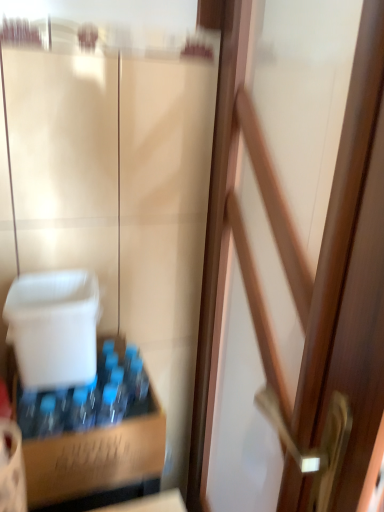
You are a GUI agent. You are given a task and a screenshot of the screen. Output one action in this format:
    pyautogui.click(x=<x>, y=<y>)
    Task: Click on the wooden door at center
    
    Given the screenshot: What is the action you would take?
    pyautogui.click(x=319, y=253)

In order to face wooden door at center, should I rotate leftwards or rightwards?

A 10.251 degree turn to the right will do.

The height and width of the screenshot is (512, 384). What do you see at coordinates (319, 253) in the screenshot?
I see `wooden door at center` at bounding box center [319, 253].

Measure the distance between point (224,249) and camera.

A distance of 1.08 meters exists between point (224,249) and camera.

Image resolution: width=384 pixels, height=512 pixels. In order to click on brown cardboard box at lower left in this screenshot , I will do `click(93, 437)`.

Describe the element at coordinates (93, 437) in the screenshot. I see `brown cardboard box at lower left` at that location.

At what (x,y) coordinates should I click in order to perform the action: click on wooden door at center. Please return your answer as a coordinate pair (x, y). Looking at the image, I should click on (319, 253).

Is brown cardboard box at lower left to the right of wooden door at center from the viewer's perspective?

In fact, brown cardboard box at lower left is to the left of wooden door at center.

From the picture: Is the position of brown cardboard box at lower left more distant than that of wooden door at center?

Yes, it is.

Considering the positions of point (97, 352) and point (333, 220), is point (97, 352) closer or farther from the camera than point (333, 220)?

Point (97, 352) is farther from the camera than point (333, 220).

From the image's perspective, would you say brown cardboard box at lower left is shown under wooden door at center?

Indeed, from the image's perspective, brown cardboard box at lower left is shown beneath wooden door at center.

From a real-world perspective, who is located higher, brown cardboard box at lower left or wooden door at center?

wooden door at center is physically above.

Is brown cardboard box at lower left wider or thinner than wooden door at center?

brown cardboard box at lower left is wider than wooden door at center.

Looking at this image, considering the sizes of objects brown cardboard box at lower left and wooden door at center in the image provided, who is taller, brown cardboard box at lower left or wooden door at center?

Standing taller between the two is wooden door at center.

In terms of size, does brown cardboard box at lower left appear bigger or smaller than wooden door at center?

Clearly, brown cardboard box at lower left is smaller in size than wooden door at center.

Could wooden door at center be considered to be inside brown cardboard box at lower left?

No, brown cardboard box at lower left does not contain wooden door at center.

From the picture: Is brown cardboard box at lower left placed right next to wooden door at center?

No, brown cardboard box at lower left is not in contact with wooden door at center.

Is brown cardboard box at lower left looking in the opposite direction of wooden door at center?

No.

At what (x,y) coordinates should I click in order to perform the action: click on door located above the brown cardboard box at lower left (from a real-world perspective). Please return your answer as a coordinate pair (x, y). Looking at the image, I should click on (319, 253).

Considering the positions of objects wooden door at center and brown cardboard box at lower left in the image provided, who is more to the left, wooden door at center or brown cardboard box at lower left?

brown cardboard box at lower left.

Which object is closer to the camera, wooden door at center or brown cardboard box at lower left?

wooden door at center is more forward.

Which is in front, point (360, 94) or point (64, 425)?

The point (360, 94) is more forward.

From the image's perspective, would you say wooden door at center is positioned over brown cardboard box at lower left?

Indeed, from the image's perspective, wooden door at center is shown above brown cardboard box at lower left.

From a real-world perspective, does wooden door at center stand above brown cardboard box at lower left?

Correct, in the physical world, wooden door at center is higher than brown cardboard box at lower left.

Looking at their sizes, would you say wooden door at center is wider or thinner than brown cardboard box at lower left?

wooden door at center is thinner than brown cardboard box at lower left.

From their relative heights in the image, would you say wooden door at center is taller or shorter than brown cardboard box at lower left?

In the image, wooden door at center appears to be taller than brown cardboard box at lower left.

Does wooden door at center have a smaller size compared to brown cardboard box at lower left?

Actually, wooden door at center might be larger than brown cardboard box at lower left.

Is wooden door at center not within brown cardboard box at lower left?

Indeed, wooden door at center is completely outside brown cardboard box at lower left.

Are wooden door at center and brown cardboard box at lower left far apart?

No, wooden door at center is not far away from brown cardboard box at lower left.

Does wooden door at center turn towards brown cardboard box at lower left?

Yes, wooden door at center is oriented towards brown cardboard box at lower left.

How many degrees apart are the facing directions of wooden door at center and brown cardboard box at lower left?

The angle between the facing direction of wooden door at center and the facing direction of brown cardboard box at lower left is 86.8 degrees.

Find the location of a particular element. cardboard box below the wooden door at center (from the image's perspective) is located at coordinates (93, 437).

Where is `door in front of the brown cardboard box at lower left`? The height and width of the screenshot is (512, 384). door in front of the brown cardboard box at lower left is located at coordinates 319,253.

You are a GUI agent. You are given a task and a screenshot of the screen. Output one action in this format:
    pyautogui.click(x=<x>, y=<y>)
    Task: Click on the door located above the brown cardboard box at lower left (from a real-world perspective)
    Image resolution: width=384 pixels, height=512 pixels.
    Given the screenshot: What is the action you would take?
    pyautogui.click(x=319, y=253)